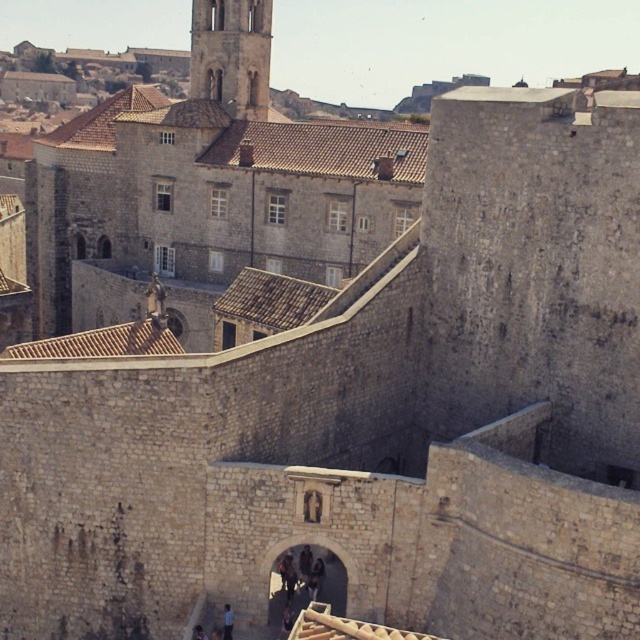
Is light beige stone tower at upper center bigger than dark blue shirt at center?

Correct, light beige stone tower at upper center is larger in size than dark blue shirt at center.

In the scene shown: Who is more forward, (244, 19) or (227, 627)?

Positioned in front is point (227, 627).

Is point (232, 38) farther from camera compared to point (227, 628)?

That is True.

Where is `light beige stone tower at upper center`? light beige stone tower at upper center is located at coordinates (230, 54).